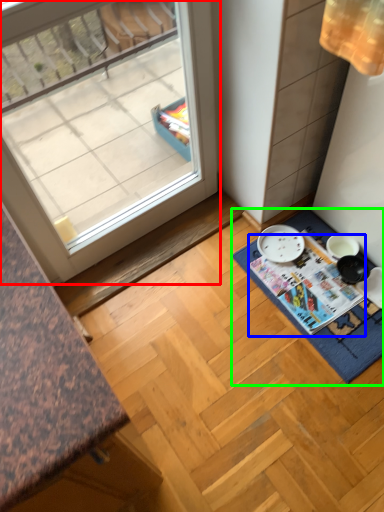
Question: Based on their relative distances, which object is farther from window (highlighted by a red box)? Choose from magazine (highlighted by a blue box) and bath mat (highlighted by a green box).

Choices:
 (A) magazine
 (B) bath mat

Answer: (B)